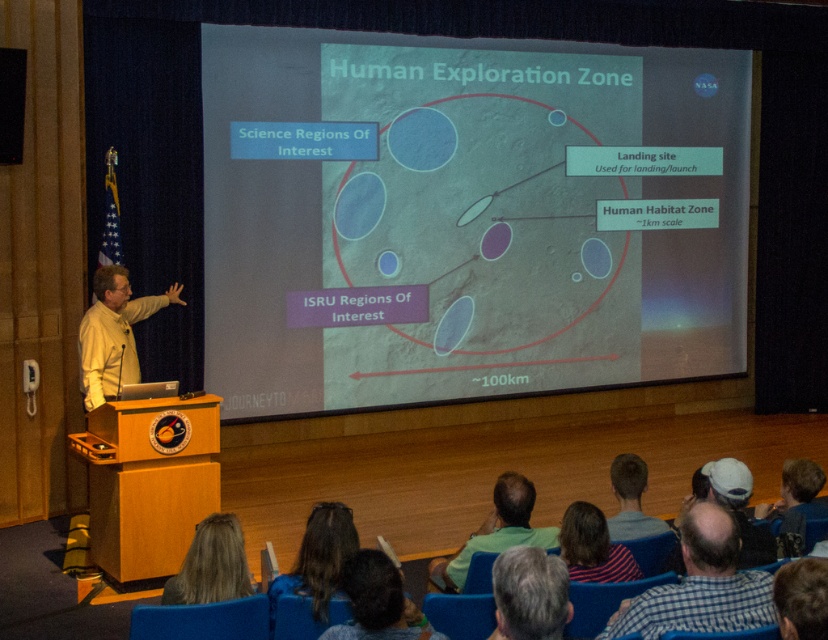
Question: Among these objects, which one is nearest to the camera?

Choices:
 (A) light brown hair at center
 (B) gray hair at center
 (C) striped shirt at center

Answer: (B)

Question: Does checkered fabric shirt at lower right lie behind gray hair at center?

Choices:
 (A) no
 (B) yes

Answer: (B)

Question: Which object is the farthest from the blonde hair at lower left?

Choices:
 (A) dark brown hair at lower center
 (B) white matte cap at lower center

Answer: (B)

Question: Is striped shirt at center in front of white matte cap at lower center?

Choices:
 (A) yes
 (B) no

Answer: (B)

Question: Among these points, which one is farthest from the camera?

Choices:
 (A) (653, 525)
 (B) (771, 545)

Answer: (A)

Question: Observing the image, what is the correct spatial positioning of dark brown hair at lower center in reference to green shirt at lower center?

Choices:
 (A) right
 (B) left

Answer: (B)